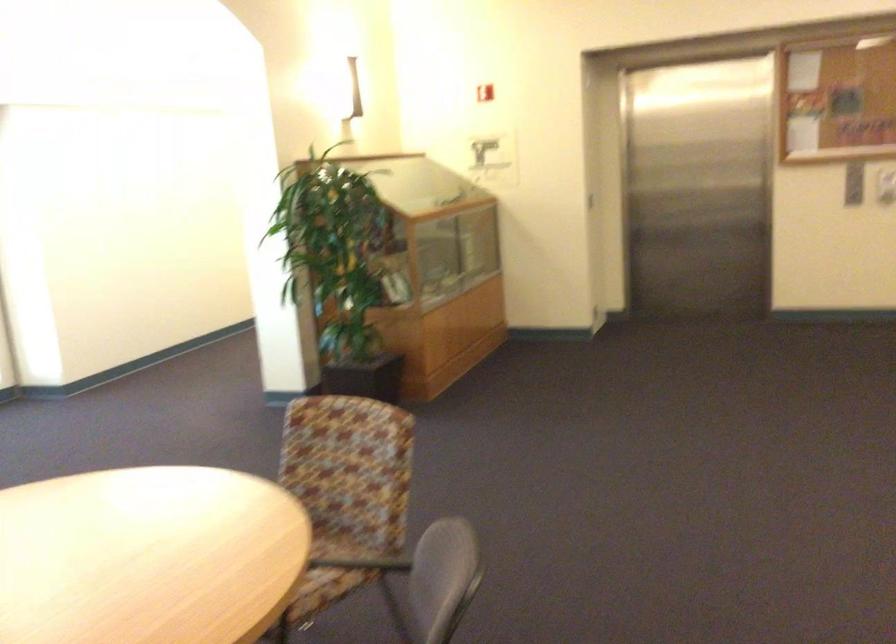
Find the location of a particular element. This screenshot has height=644, width=896. patterned chair sitting surface is located at coordinates (288, 535).